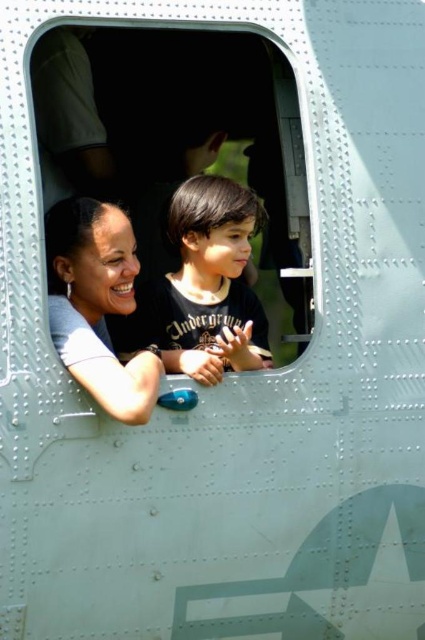
Which of these two, matte gray shirt at upper left or smooth skin nose at center, stands shorter?

With less height is smooth skin nose at center.

In the scene shown: Can you confirm if matte gray shirt at upper left is shorter than smooth skin nose at center?

No.

Is point (146, 353) behind point (240, 237)?

No, (146, 353) is in front of (240, 237).

Where is `matte gray shirt at upper left`? The height and width of the screenshot is (640, 425). matte gray shirt at upper left is located at coordinates (96, 305).

Is the position of dark brown hair at center more distant than that of matte black nose at center?

No, it is in front of matte black nose at center.

At what (x,y) coordinates should I click in order to perform the action: click on dark brown hair at center. Please return your answer as a coordinate pair (x, y). This screenshot has height=640, width=425. Looking at the image, I should click on (209, 284).

Between point (184, 337) and point (133, 273), which one is positioned behind?

The point (184, 337) is behind.

Where is `dark brown hair at center`? The width and height of the screenshot is (425, 640). dark brown hair at center is located at coordinates (209, 284).

Is matte black nose at center to the right of smooth skin nose at center from the viewer's perspective?

In fact, matte black nose at center is to the left of smooth skin nose at center.

The height and width of the screenshot is (640, 425). What do you see at coordinates (130, 266) in the screenshot?
I see `matte black nose at center` at bounding box center [130, 266].

Find the location of a particular element. The width and height of the screenshot is (425, 640). matte black nose at center is located at coordinates (130, 266).